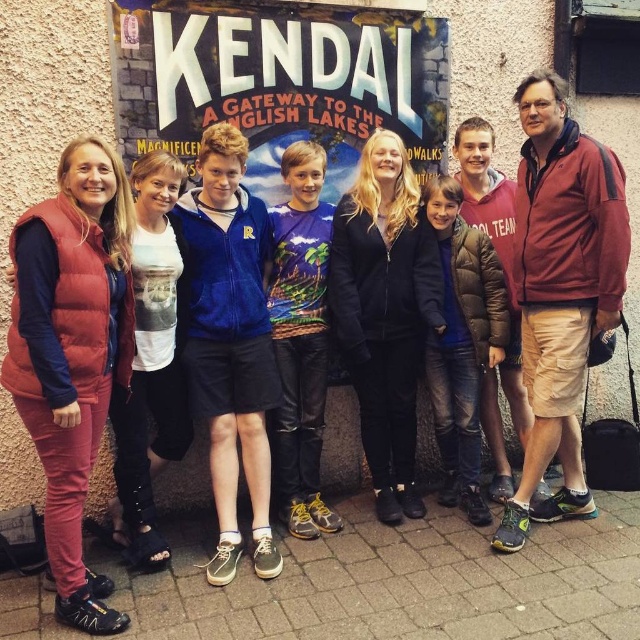
Question: Which point is closer to the camera taking this photo?

Choices:
 (A) (163, 310)
 (B) (444, 385)
 (C) (301, 344)

Answer: (A)

Question: Is blue velour jacket at center in front of white cotton t-shirt at center?

Choices:
 (A) no
 (B) yes

Answer: (A)

Question: Which object appears farthest from the camera in this image?

Choices:
 (A) matte signboard at center
 (B) printed jersey at center

Answer: (B)

Question: Which object is the closest to the blue velour jacket at center?

Choices:
 (A) dark brown puffer jacket at center
 (B) matte signboard at center

Answer: (B)

Question: Is blue velour jacket at center to the right of white cotton t-shirt at center from the viewer's perspective?

Choices:
 (A) no
 (B) yes

Answer: (B)

Question: Is matte signboard at center above printed jersey at center?

Choices:
 (A) no
 (B) yes

Answer: (B)